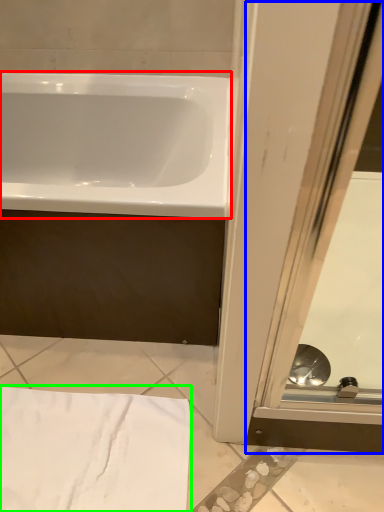
Question: Considering the real-world distances, which object is closest to bathtub (highlighted by a red box)? screen door (highlighted by a blue box) or bath towel (highlighted by a green box).

Choices:
 (A) screen door
 (B) bath towel

Answer: (A)